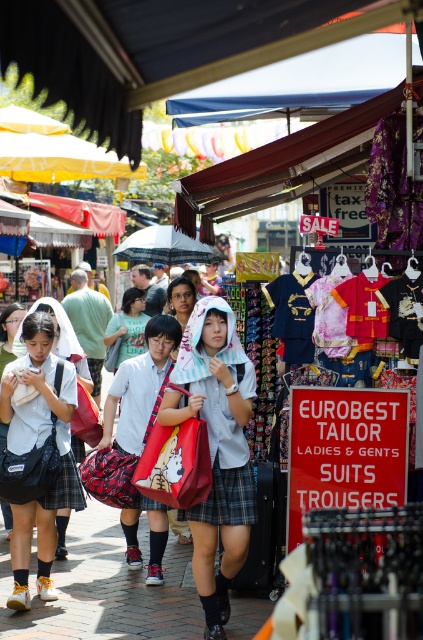
Between matte black school uniform at left and white fabric umbrella at center, which one has more height?

matte black school uniform at left

Can you confirm if matte black school uniform at left is positioned to the left of white fabric umbrella at center?

Yes, matte black school uniform at left is to the left of white fabric umbrella at center.

Between point (21, 332) and point (200, 243), which one is positioned behind?

Positioned behind is point (200, 243).

The width and height of the screenshot is (423, 640). I want to click on matte black school uniform at left, so click(x=36, y=448).

Does plaid fabric skirt at center have a greater width compared to plaid fabric kilt at center?

Indeed, plaid fabric skirt at center has a greater width compared to plaid fabric kilt at center.

Who is taller, plaid fabric skirt at center or plaid fabric kilt at center?

With more height is plaid fabric skirt at center.

Does point (236, 516) lie in front of point (236, 492)?

That is True.

Find the location of a particular element. plaid fabric skirt at center is located at coordinates (216, 449).

Is plaid fabric kilt at center further to the viewer compared to white fabric umbrella at center?

No, plaid fabric kilt at center is closer to the viewer.

Which is in front, point (244, 499) or point (153, 241)?

Positioned in front is point (244, 499).

The height and width of the screenshot is (640, 423). What are the coordinates of `plaid fabric kilt at center` in the screenshot? It's located at (227, 497).

The height and width of the screenshot is (640, 423). Find the location of `plaid fabric kilt at center`. plaid fabric kilt at center is located at coordinates (227, 497).